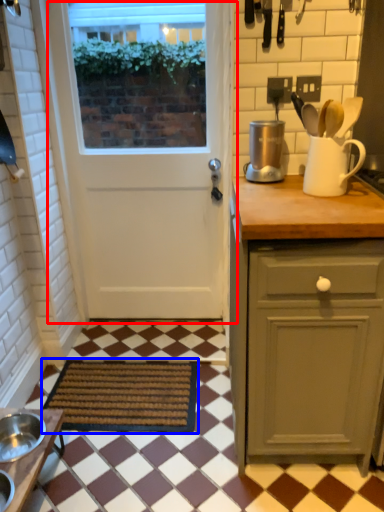
Question: Which point is further to the camera, door (highlighted by a red box) or mat (highlighted by a blue box)?

Choices:
 (A) door
 (B) mat

Answer: (A)